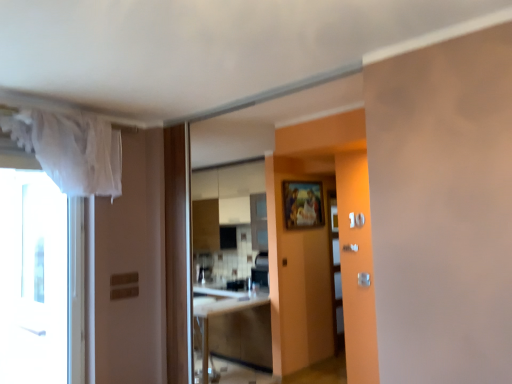
Question: From the image's perspective, does white sheer curtain at upper left appear higher than wooden cabinet at center?

Choices:
 (A) yes
 (B) no

Answer: (A)

Question: Is white sheer curtain at upper left far from wooden cabinet at center?

Choices:
 (A) no
 (B) yes

Answer: (B)

Question: Considering the relative sizes of white sheer curtain at upper left and wooden cabinet at center in the image provided, is white sheer curtain at upper left shorter than wooden cabinet at center?

Choices:
 (A) yes
 (B) no

Answer: (A)

Question: Is white sheer curtain at upper left behind wooden cabinet at center?

Choices:
 (A) no
 (B) yes

Answer: (A)

Question: Considering the relative sizes of white sheer curtain at upper left and wooden cabinet at center in the image provided, is white sheer curtain at upper left taller than wooden cabinet at center?

Choices:
 (A) no
 (B) yes

Answer: (A)

Question: From a real-world perspective, relative to wooden painted frame at center, is satin silver door handle at center right, placed as the second door handle when sorted from left to right, vertically above or below?

Choices:
 (A) above
 (B) below

Answer: (B)

Question: Relative to wooden painted frame at center, is satin silver door handle at center right, marked as the 1th door handle in a front-to-back arrangement, in front or behind?

Choices:
 (A) behind
 (B) front

Answer: (B)

Question: Is satin silver door handle at center right, marked as the 1th door handle in a front-to-back arrangement, bigger or smaller than wooden painted frame at center?

Choices:
 (A) small
 (B) big

Answer: (A)

Question: Which is correct: satin silver door handle at center right, which is counted as the 1th door handle, starting from the bottom, is inside wooden painted frame at center, or outside of it?

Choices:
 (A) inside
 (B) outside

Answer: (B)

Question: Looking at the image, does white glass window at left seem bigger or smaller compared to wooden cabinet at center?

Choices:
 (A) big
 (B) small

Answer: (B)

Question: From the image's perspective, is white glass window at left above or below wooden cabinet at center?

Choices:
 (A) below
 (B) above

Answer: (B)

Question: Would you say white glass window at left is inside or outside wooden cabinet at center?

Choices:
 (A) outside
 (B) inside

Answer: (A)

Question: Considering the positions of white glass window at left and wooden cabinet at center in the image, is white glass window at left taller or shorter than wooden cabinet at center?

Choices:
 (A) short
 (B) tall

Answer: (B)

Question: From a real-world perspective, relative to wooden painted frame at center, is white sheer curtain at upper left vertically above or below?

Choices:
 (A) below
 (B) above

Answer: (B)

Question: Relative to wooden painted frame at center, is white sheer curtain at upper left in front or behind?

Choices:
 (A) front
 (B) behind

Answer: (A)